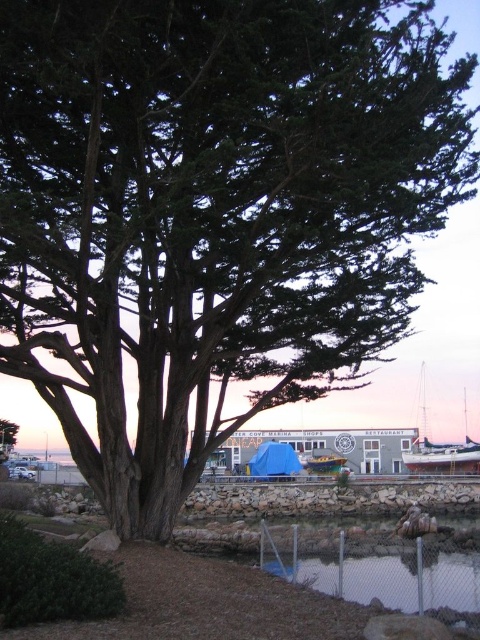
In the scene shown: Which of these two, white glossy sailboat at center or white glossy boat at lower right, stands taller?

With more height is white glossy sailboat at center.

Can you confirm if white glossy sailboat at center is positioned to the right of white glossy boat at lower right?

Indeed, white glossy sailboat at center is positioned on the right side of white glossy boat at lower right.

Where is `white glossy sailboat at center`? Image resolution: width=480 pixels, height=640 pixels. white glossy sailboat at center is located at coordinates (441, 449).

Can you confirm if clear water at lower center is shorter than white glossy boat at lower right?

Yes.

Does point (466, 579) come behind point (422, 445)?

No, it is in front of (422, 445).

Is point (302, 570) farther from camera compared to point (442, 468)?

No, (302, 570) is in front of (442, 468).

Where is `clear water at lower center`? clear water at lower center is located at coordinates (389, 579).

Who is lower down, clear water at lower center or white glossy sailboat at center?

Positioned lower is white glossy sailboat at center.

Describe the element at coordinates (389, 579) in the screenshot. The width and height of the screenshot is (480, 640). I see `clear water at lower center` at that location.

Where is `clear water at lower center`? This screenshot has height=640, width=480. clear water at lower center is located at coordinates (389, 579).